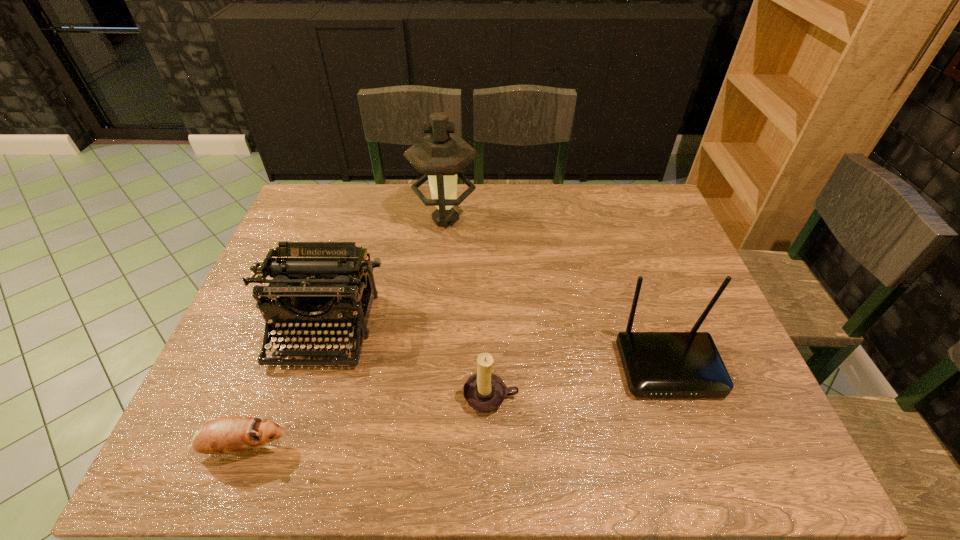
You are a GUI agent. You are given a task and a screenshot of the screen. Output one action in this format:
    pyautogui.click(x=<x>, y=<y>)
    Task: Click on the free region at the near left corner of the desktop
    
    Given the screenshot: What is the action you would take?
    pyautogui.click(x=223, y=457)

Locate an element on the screen. Image resolution: width=960 pixels, height=540 pixels. free region at the far right corner of the desktop is located at coordinates (612, 194).

Locate an element on the screen. free region at the near right corner of the desktop is located at coordinates (773, 446).

Where is `empty space between the rightmost object and the fourth tallest object`? Image resolution: width=960 pixels, height=540 pixels. empty space between the rightmost object and the fourth tallest object is located at coordinates (579, 382).

Locate an element on the screen. The height and width of the screenshot is (540, 960). free space between the hamster and the typewriter is located at coordinates (283, 388).

Where is `free space between the nearest object and the rightmost object`? The width and height of the screenshot is (960, 540). free space between the nearest object and the rightmost object is located at coordinates (456, 407).

Identify the location of vacant area that lies between the candle holder and the router. The width and height of the screenshot is (960, 540). (579, 382).

Identify the location of free space between the oil lamp and the candle holder. pos(468,308).

Locate an element on the screen. Image resolution: width=960 pixels, height=540 pixels. free space between the typewriter and the second shortest object is located at coordinates (407, 363).

Identify the location of vacant area that lies between the router and the farthest object. This screenshot has width=960, height=540. (557, 293).